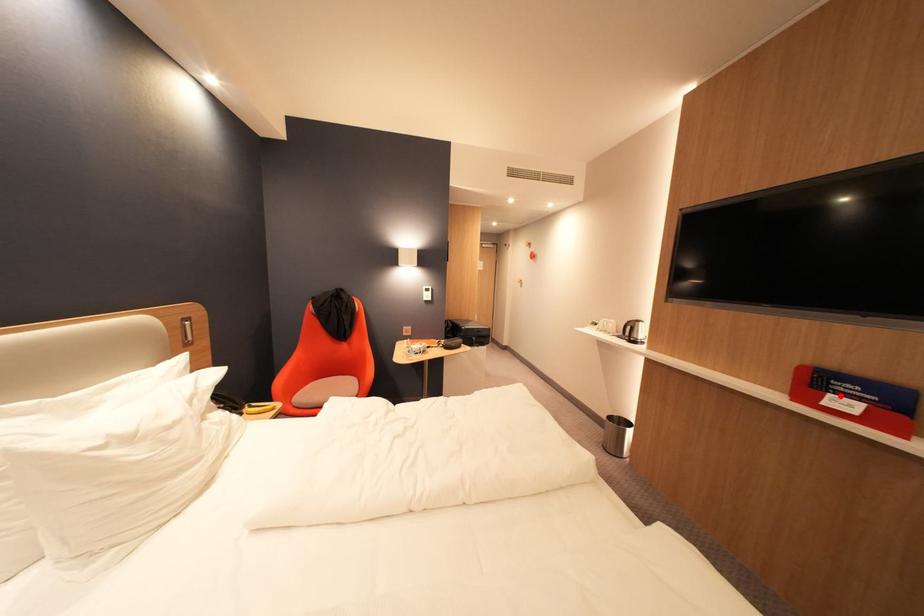
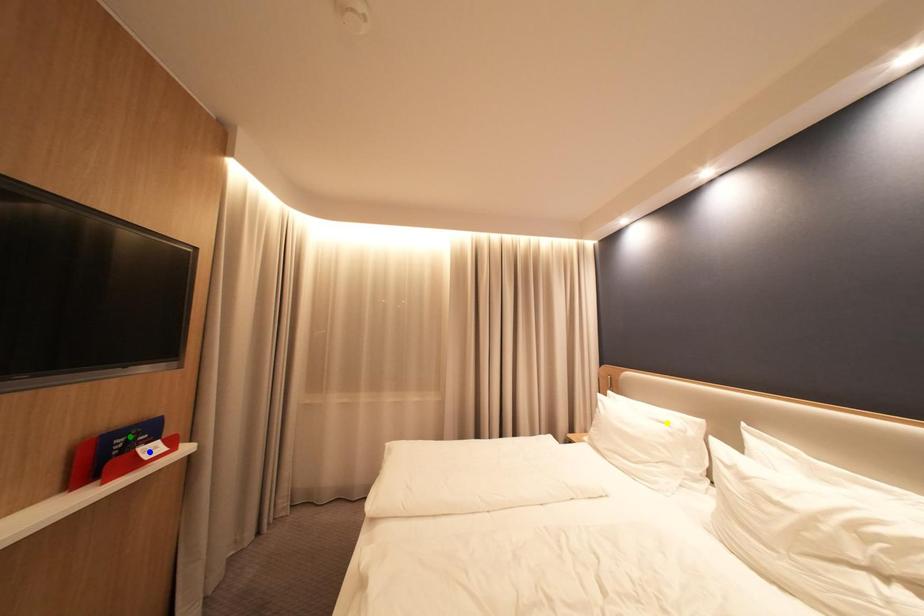
Question: I am providing you with two images of the same scene from different viewpoints. A red point is marked on the first image. You are given multiple points on the second image. Which point in image 2 is actually the same real-world point as the red point in image 1?

Choices:
 (A) yellow point
 (B) green point
 (C) blue point

Answer: (C)